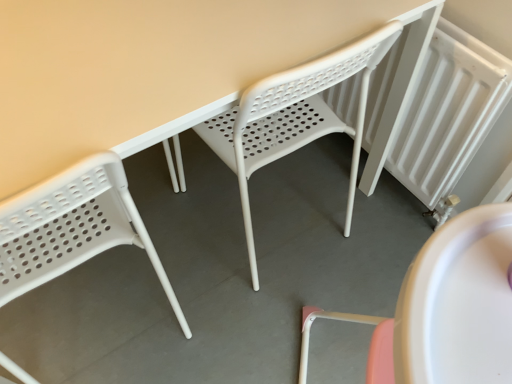
Find the location of `vacant space to the left of white textured radiator at right`. vacant space to the left of white textured radiator at right is located at coordinates (304, 193).